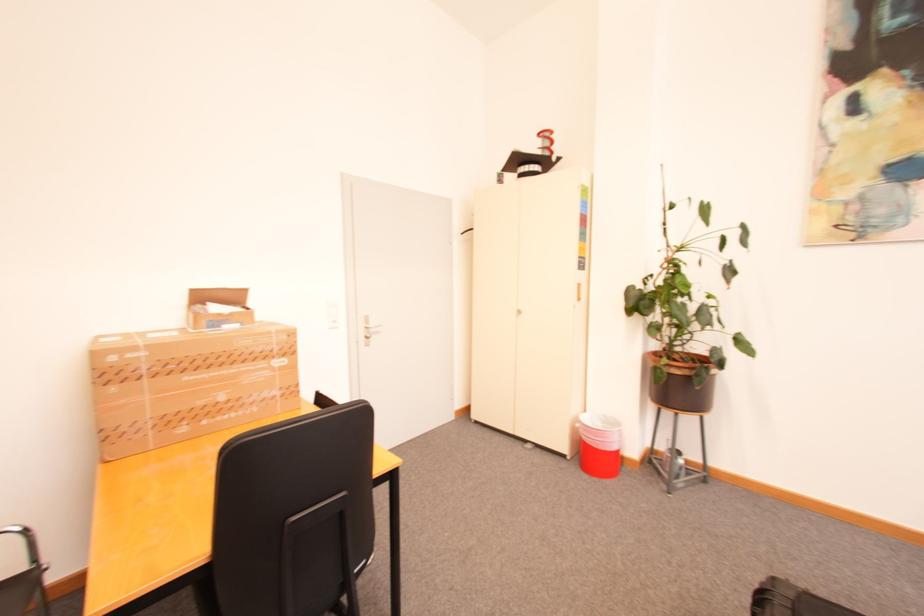
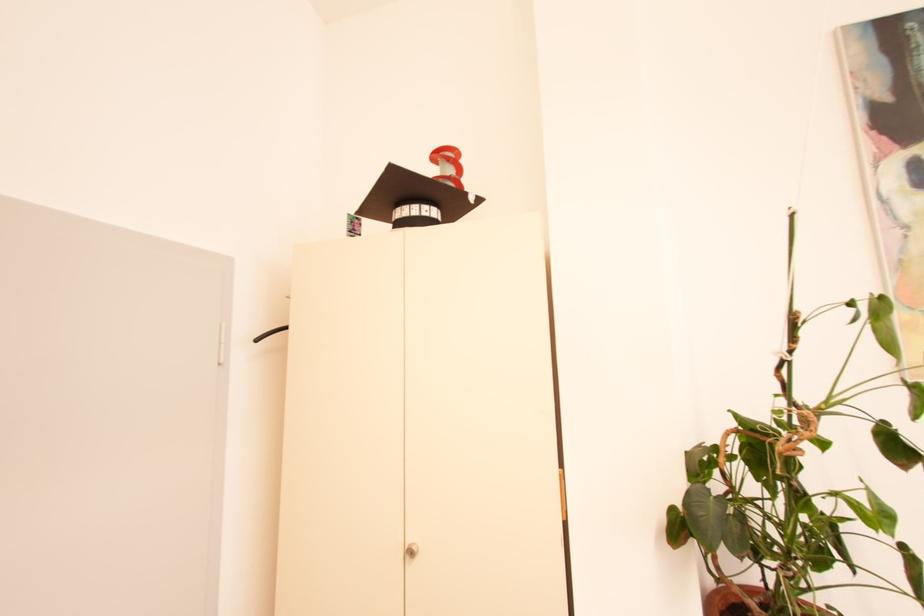
In the second image, find the point that corresponds to (x=552, y=138) in the first image.

(455, 160)